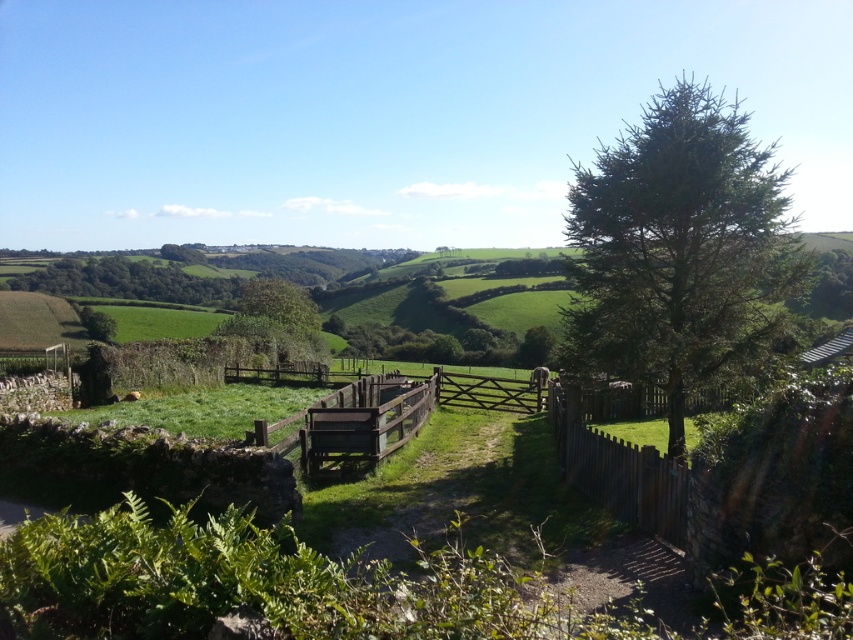
Question: Can you confirm if brown wooden fence at center is wider than green leafy tree at left?

Choices:
 (A) yes
 (B) no

Answer: (B)

Question: Is green needle-like tree at right wider than green leafy tree at left?

Choices:
 (A) yes
 (B) no

Answer: (A)

Question: Which object is farther from the camera taking this photo?

Choices:
 (A) green leafy tree at left
 (B) brown wooden fence at right

Answer: (A)

Question: Which of these objects is positioned closest to the green leafy tree at left?

Choices:
 (A) green needle-like tree at right
 (B) brown wooden fence at center

Answer: (B)

Question: Does green needle-like tree at right appear under green leafy tree at left?

Choices:
 (A) yes
 (B) no

Answer: (B)

Question: Which point is farther from the camera taking this photo?

Choices:
 (A) (376, 435)
 (B) (260, 310)
 (C) (154, 273)

Answer: (C)